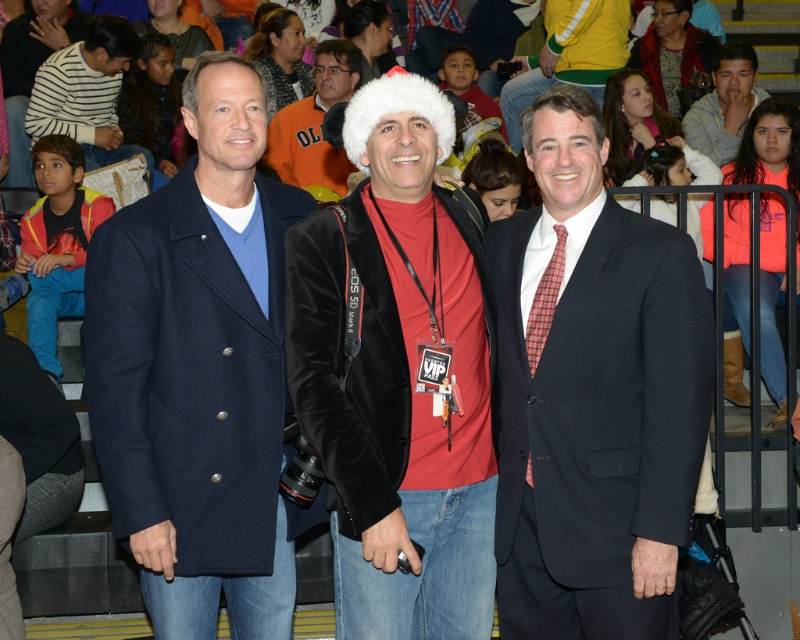
Question: Which of the following is the closest to the observer?

Choices:
 (A) navy wool coat at center
 (B) velvet jacket at center
 (C) striped sweater at left
 (D) matte black suit at center

Answer: (D)

Question: Can you confirm if matte black suit at center is thinner than velvet santa hat at center?

Choices:
 (A) yes
 (B) no

Answer: (B)

Question: Which point appears closest to the camera in this image?

Choices:
 (A) [358, 51]
 (B) [316, 419]

Answer: (B)

Question: Can you confirm if navy wool coat at center is positioned to the right of striped sweater at left?

Choices:
 (A) no
 (B) yes

Answer: (B)

Question: Which object is closer to the camera taking this photo?

Choices:
 (A) striped sweater at left
 (B) velvet jacket at center
 (C) matte black suit at center

Answer: (C)

Question: Can you confirm if matte black suit at center is positioned below velvet santa hat at center?

Choices:
 (A) yes
 (B) no

Answer: (A)